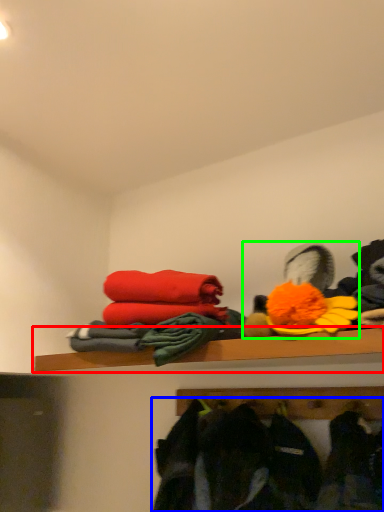
Question: Which is nearer to the shelf (highlighted by a red box)? clothing (highlighted by a blue box) or toy (highlighted by a green box).

Choices:
 (A) clothing
 (B) toy

Answer: (B)